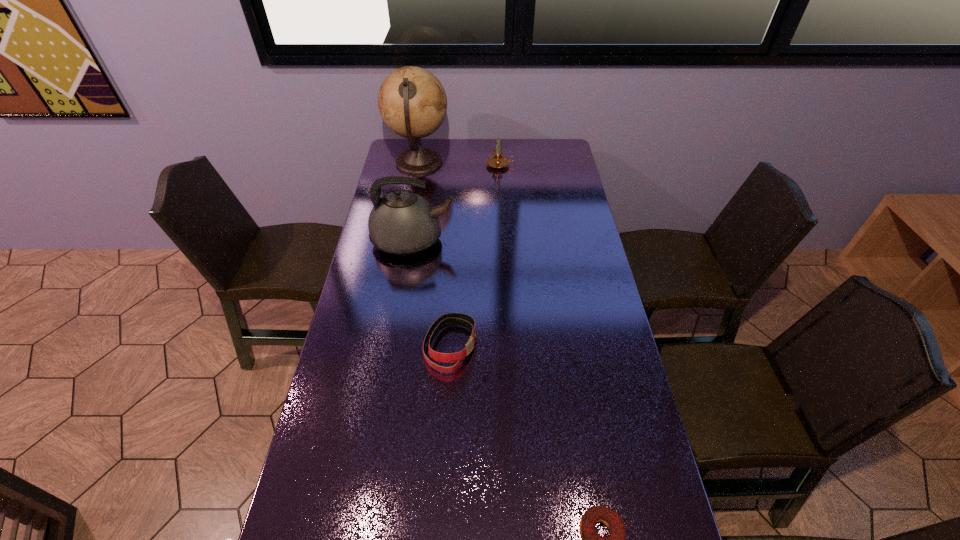
The width and height of the screenshot is (960, 540). I want to click on the tallest object, so click(x=412, y=102).

I want to click on the fourth shortest object, so click(x=403, y=223).

The width and height of the screenshot is (960, 540). What are the coordinates of `kettle` in the screenshot? It's located at (403, 223).

Where is `the third tallest object`? the third tallest object is located at coordinates (497, 161).

Find the location of a particular element. The width and height of the screenshot is (960, 540). candle is located at coordinates (497, 161).

Where is `dog collar`? dog collar is located at coordinates (464, 320).

Find the location of `the second shortest object`. the second shortest object is located at coordinates (464, 320).

The image size is (960, 540). Find the location of `blank area located 0.240m on the front-facing side of the globe`. blank area located 0.240m on the front-facing side of the globe is located at coordinates (503, 163).

Where is `vacant point located at the spout of the fourth shortest object`? Image resolution: width=960 pixels, height=540 pixels. vacant point located at the spout of the fourth shortest object is located at coordinates (512, 240).

Identify the location of free space located 0.130m on the left of the second object from right to left. The image size is (960, 540). (457, 165).